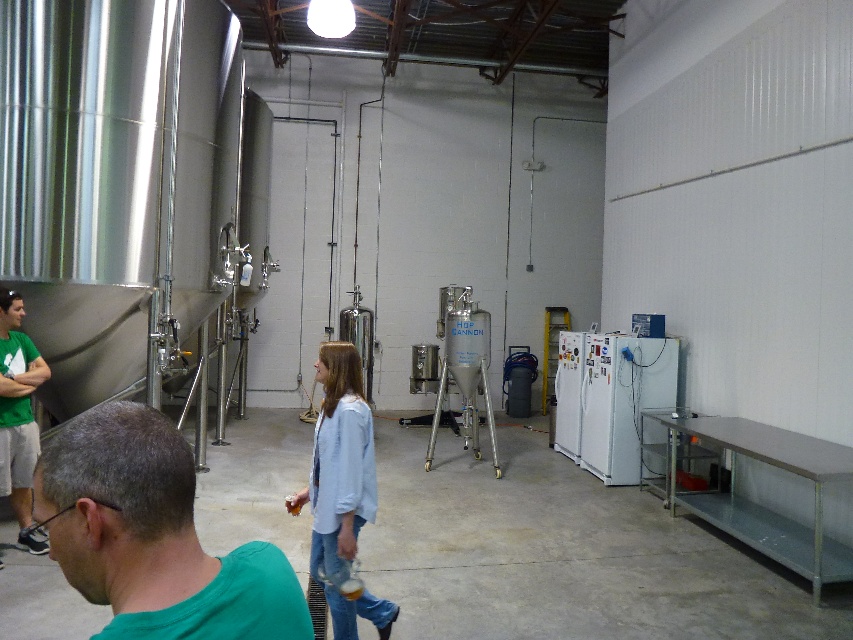
You are an inspector in this brewery and you need to check the equipment near the green matte shirt at lower left and the light blue denim jacket at center. Which piece of clothing is closer to the equipment you need to inspect first?

The green matte shirt at lower left is positioned over the light blue denim jacket at center, so the equipment near the green matte shirt at lower left is closer. You should inspect the equipment near the green matte shirt at lower left first.

From the picture: You are a delivery person carrying a 2.5 meter long pipe that needs to be moved through the space between the green matte shirt at lower left and the light blue denim jacket at center. Can you fit the pipe between them without bending it?

The distance between the green matte shirt at lower left and the light blue denim jacket at center is 2.16 meters. Since the pipe is 2.5 meters long, it cannot fit straight between them without bending.